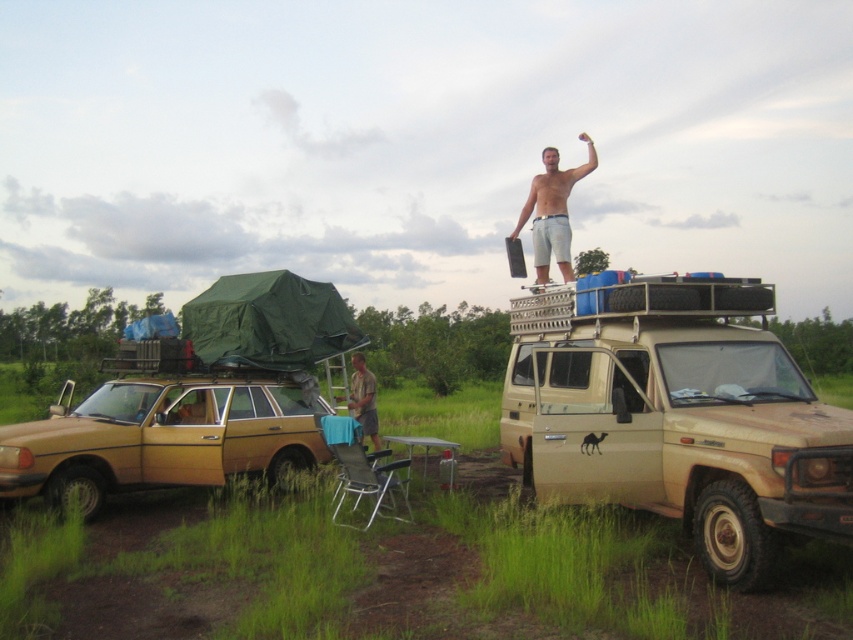
Who is positioned more to the left, beige matte pickup truck at upper right or gold matte station wagon at lower left?

gold matte station wagon at lower left

What do you see at coordinates (676, 417) in the screenshot? I see `beige matte pickup truck at upper right` at bounding box center [676, 417].

At what (x,y) coordinates should I click in order to perform the action: click on beige matte pickup truck at upper right. Please return your answer as a coordinate pair (x, y). The width and height of the screenshot is (853, 640). Looking at the image, I should click on (676, 417).

Between beige matte pickup truck at upper right and brown fabric shirt at center, which one has less height?

brown fabric shirt at center is shorter.

Which is above, beige matte pickup truck at upper right or brown fabric shirt at center?

beige matte pickup truck at upper right

Between point (554, 285) and point (372, 372), which one is positioned behind?

The point (372, 372) is more distant.

At what (x,y) coordinates should I click in order to perform the action: click on beige matte pickup truck at upper right. Please return your answer as a coordinate pair (x, y). This screenshot has height=640, width=853. Looking at the image, I should click on (676, 417).

Between beige matte pickup truck at upper right and skinny white shorts at upper right, which one has less height?

beige matte pickup truck at upper right

Is beige matte pickup truck at upper right positioned in front of skinny white shorts at upper right?

Yes, beige matte pickup truck at upper right is closer to the viewer.

Is point (769, 525) positioned behind point (585, 172)?

No, it is not.

This screenshot has width=853, height=640. Find the location of `beige matte pickup truck at upper right`. beige matte pickup truck at upper right is located at coordinates (676, 417).